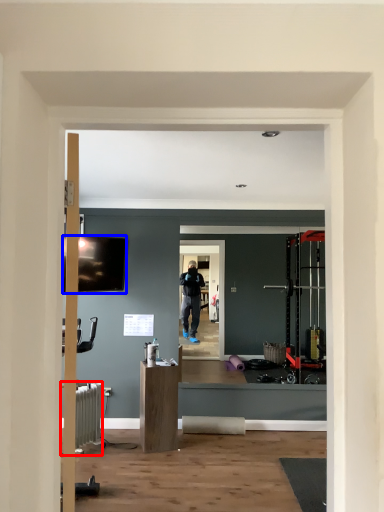
Question: Which object appears closest to the camera in this image, radiator (highlighted by a red box) or television (highlighted by a blue box)?

Choices:
 (A) radiator
 (B) television

Answer: (A)